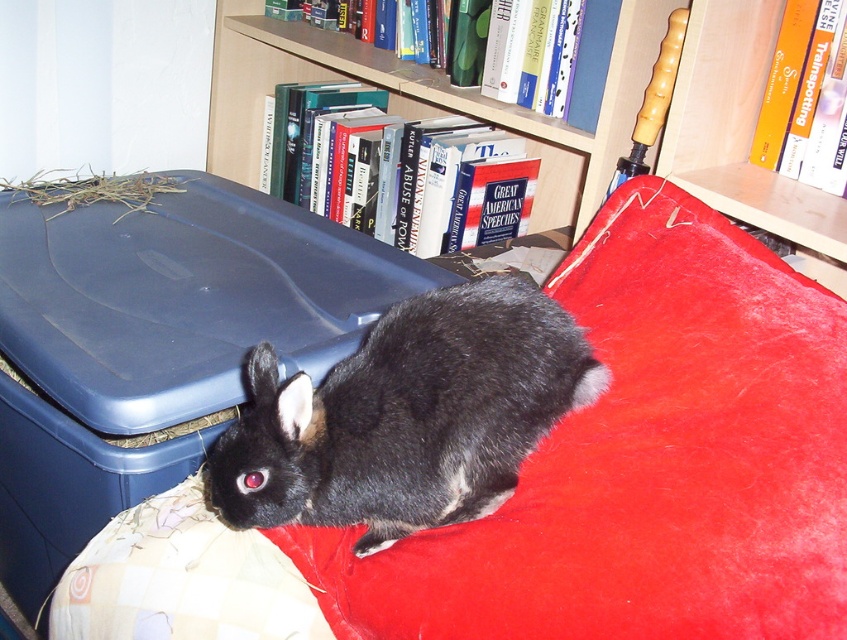
You are a cat sitting on the sofa and want to jump onto the velvet red pillow at lower center. Can you jump over the black fur rabbit at center to reach the pillow?

The velvet red pillow at lower center is much taller than the black fur rabbit at center, so you can jump over the black fur rabbit at center to reach the pillow.